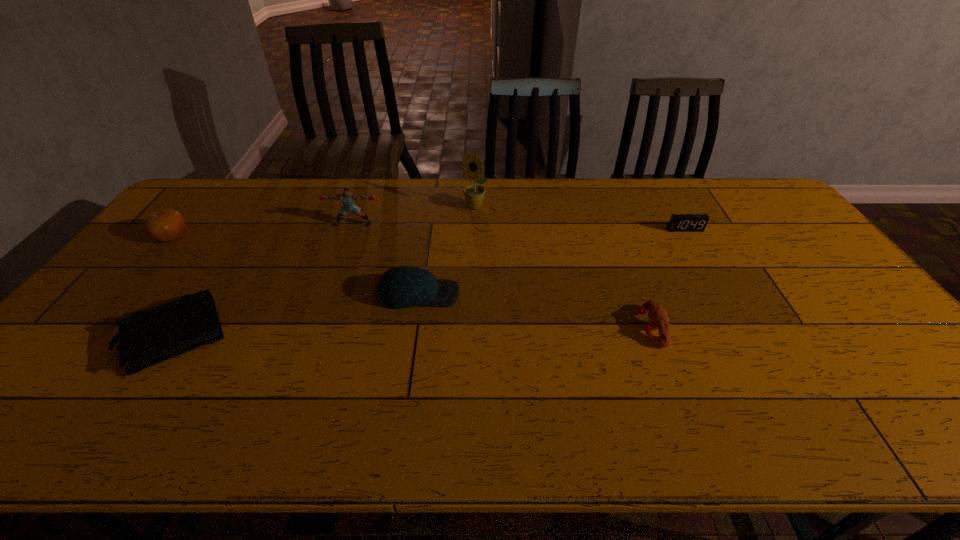
Locate an element on the screen. vacant space situated 0.100m on the face of the farthest object is located at coordinates (473, 231).

I want to click on vacant space situated on the front-facing side of the taller puncher, so click(x=347, y=242).

This screenshot has height=540, width=960. Find the location of `vacant space located on the right of the clementine`. vacant space located on the right of the clementine is located at coordinates (267, 236).

This screenshot has height=540, width=960. Find the location of `vacant space located 0.270m on the back of the baseball cap`. vacant space located 0.270m on the back of the baseball cap is located at coordinates (429, 223).

Find the location of `free spot located on the front-facing side of the alarm clock`. free spot located on the front-facing side of the alarm clock is located at coordinates (696, 249).

Locate an element on the screen. Image resolution: width=960 pixels, height=540 pixels. free space located 0.150m on the back of the Bible is located at coordinates (221, 265).

Find the location of `free region located 0.370m with the gloves of the shorter puncher facing forward`. free region located 0.370m with the gloves of the shorter puncher facing forward is located at coordinates click(494, 328).

Locate an element on the screen. The image size is (960, 540). free region located with the gloves of the shorter puncher facing forward is located at coordinates (561, 328).

Image resolution: width=960 pixels, height=540 pixels. Find the location of `free region located 0.170m with the gloves of the shorter puncher facing forward`. free region located 0.170m with the gloves of the shorter puncher facing forward is located at coordinates (572, 328).

This screenshot has height=540, width=960. I want to click on object positioned at the far edge, so pos(474,194).